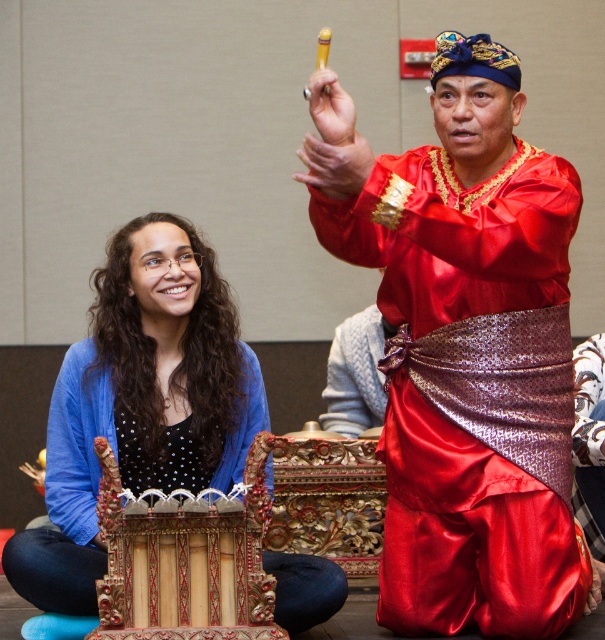
Question: Can you confirm if shiny red fabric at center is wider than wooden instrument at lower left?

Choices:
 (A) yes
 (B) no

Answer: (A)

Question: Is shiny red fabric at center thinner than wooden instrument at lower left?

Choices:
 (A) no
 (B) yes

Answer: (A)

Question: Is shiny red fabric at center in front of wooden instrument at lower left?

Choices:
 (A) yes
 (B) no

Answer: (A)